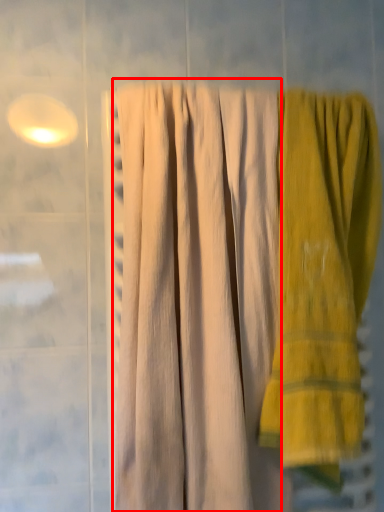
Question: From the image's perspective, considering the relative positions of curtain (annotated by the red box) and towel in the image provided, where is curtain (annotated by the red box) located with respect to the staircase?

Choices:
 (A) below
 (B) above

Answer: (B)